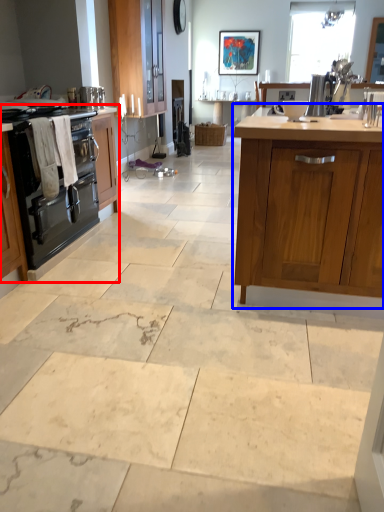
Question: Among these objects, which one is nearest to the camera, cabinetry (highlighted by a red box) or cabinetry (highlighted by a blue box)?

Choices:
 (A) cabinetry
 (B) cabinetry

Answer: (B)